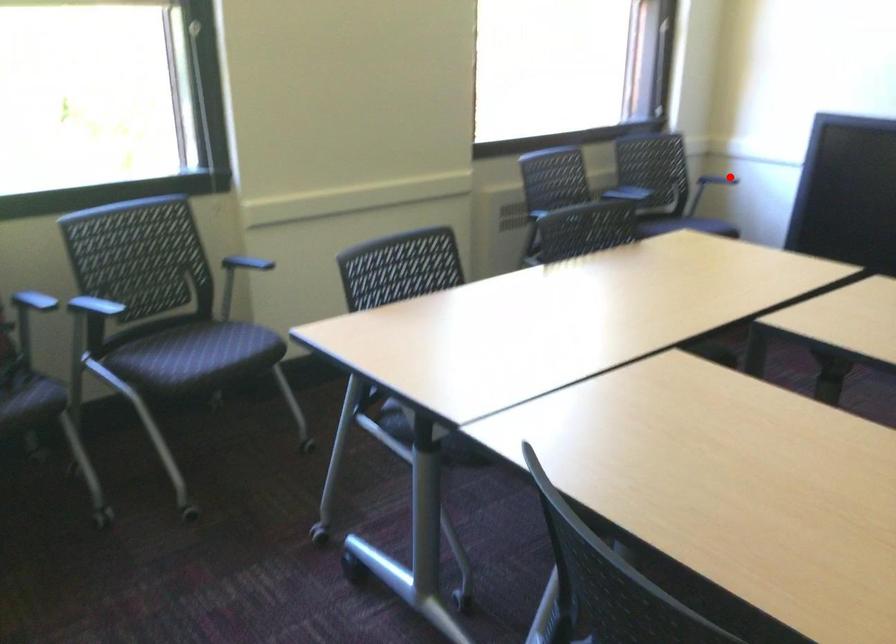
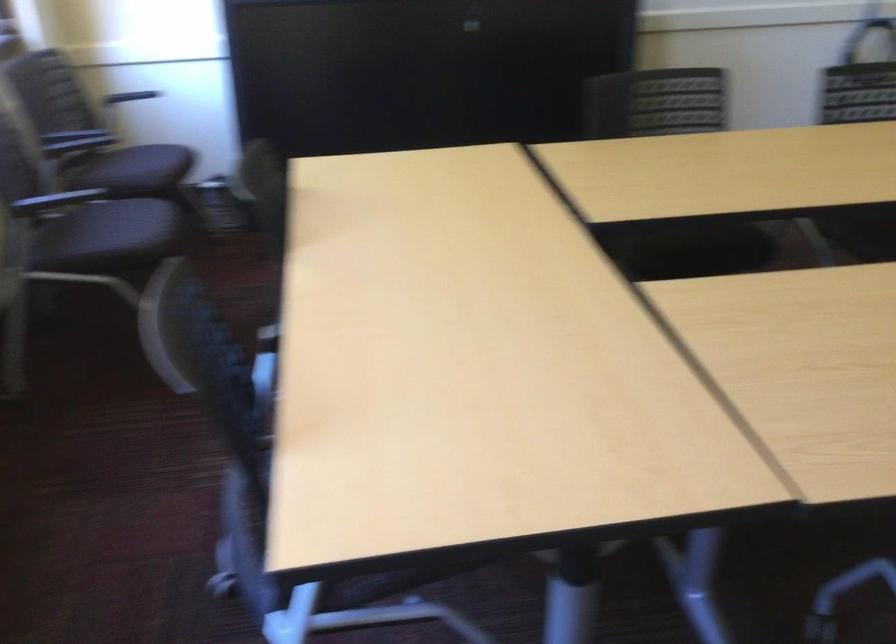
Question: I am providing you with two images of the same scene from different viewpoints. Given a red point in image1, look at the same physical point in image2. Is it:

Choices:
 (A) Closer to the viewpoint
 (B) Farther from the viewpoint

Answer: (A)